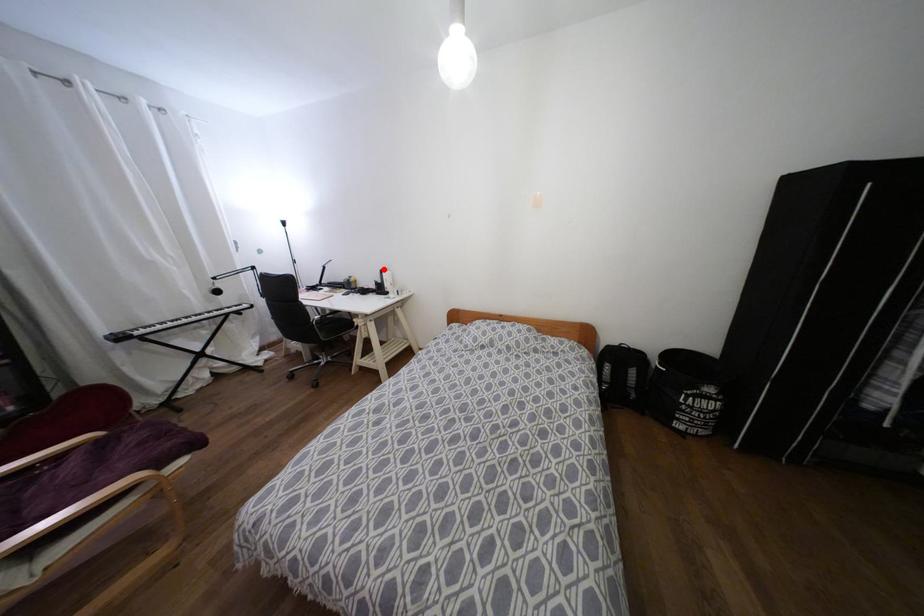
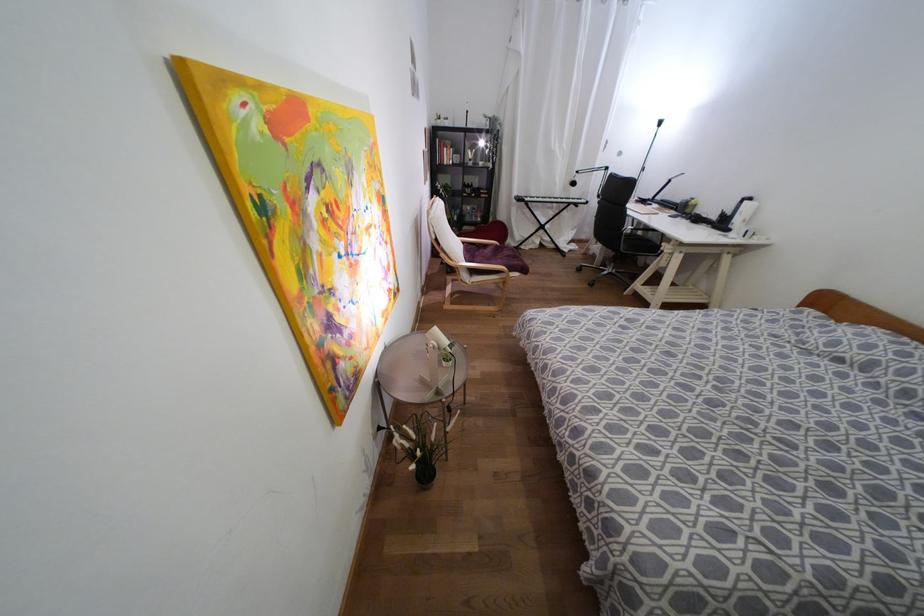
Question: I am providing you with two images of the same scene from different viewpoints. A red point is shown in image1. For the corresponding object point in image2, is it positioned nearer or farther from the camera?

Choices:
 (A) Nearer
 (B) Farther

Answer: (B)